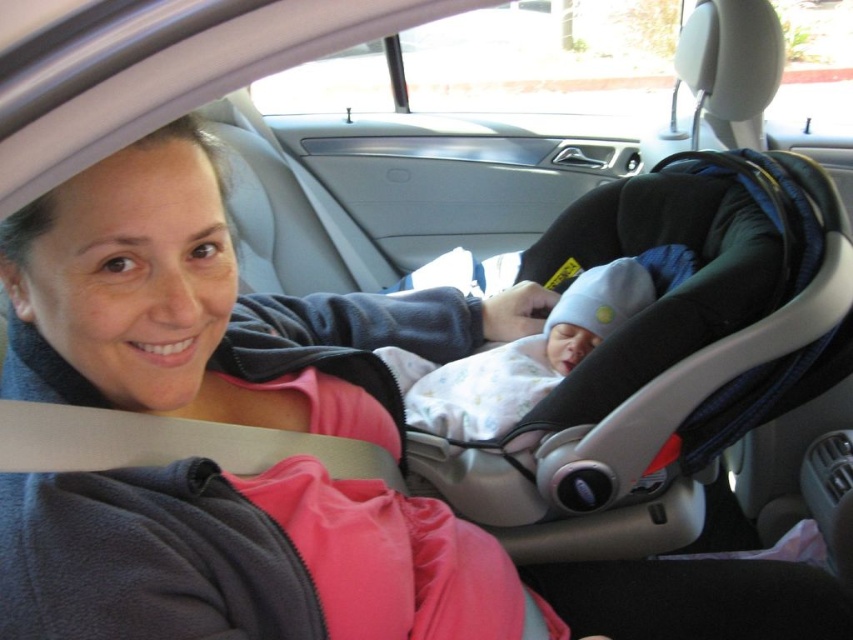
Question: Is black textured car seat at center above white soft fabric baby at center?

Choices:
 (A) yes
 (B) no

Answer: (A)

Question: Can you confirm if black textured car seat at center is positioned to the right of white soft fabric baby at center?

Choices:
 (A) yes
 (B) no

Answer: (A)

Question: Which point is closer to the camera?

Choices:
 (A) black textured car seat at center
 (B) white soft fabric baby at center

Answer: (A)

Question: Observing the image, what is the correct spatial positioning of black textured car seat at center in reference to white soft fabric baby at center?

Choices:
 (A) below
 (B) above

Answer: (B)

Question: Which point appears farthest from the camera in this image?

Choices:
 (A) (751, 228)
 (B) (527, 408)

Answer: (A)